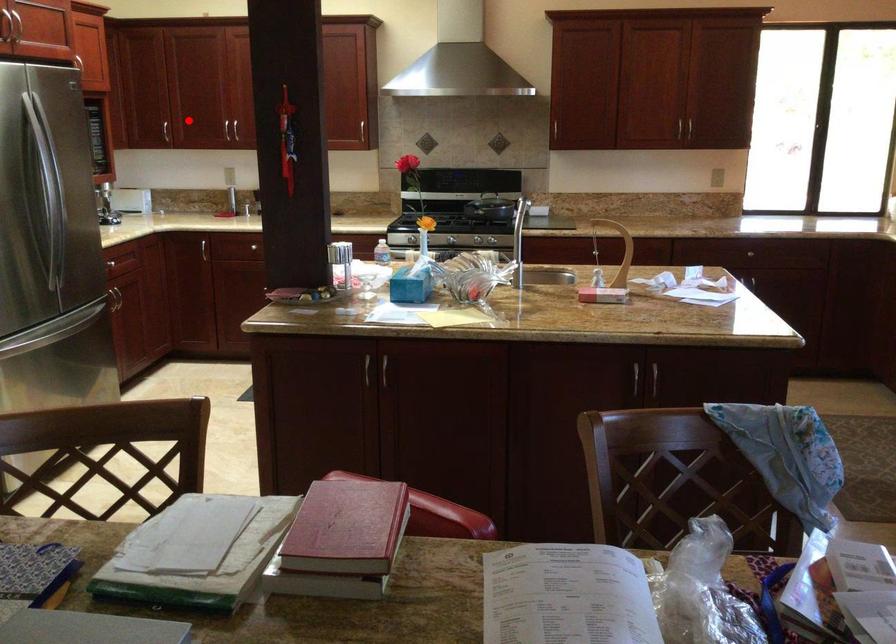
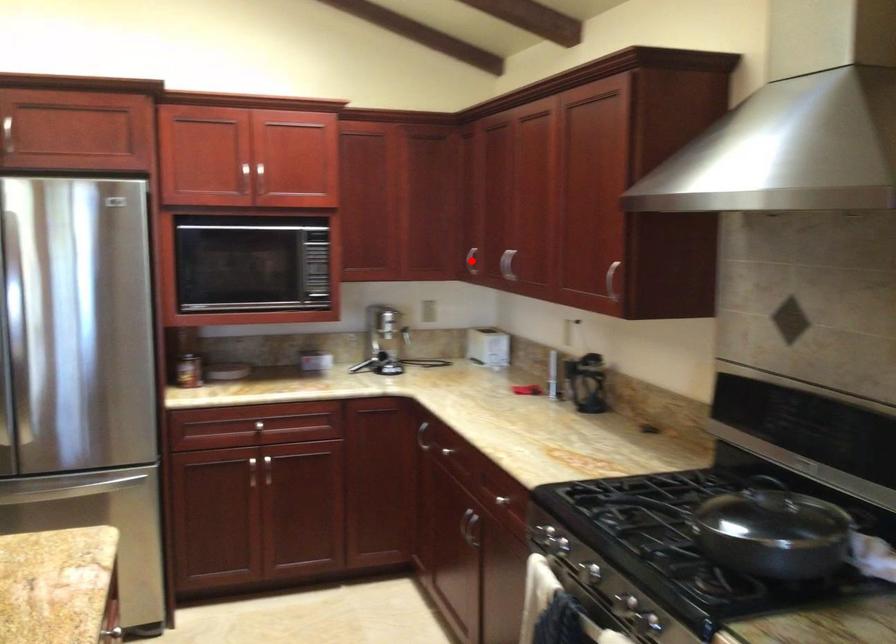
I am providing you with two images of the same scene from different viewpoints. A red point is marked on the first image and another point is marked on the second image. Does the point marked in image1 correspond to the same location as the one in image2?

No